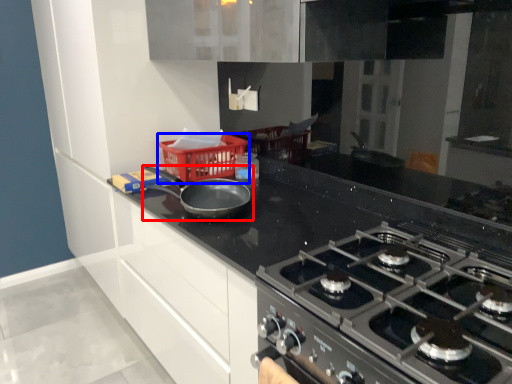
Question: Which object is further to the camera taking this photo, kitchen appliance (highlighted by a red box) or basket (highlighted by a blue box)?

Choices:
 (A) kitchen appliance
 (B) basket

Answer: (B)